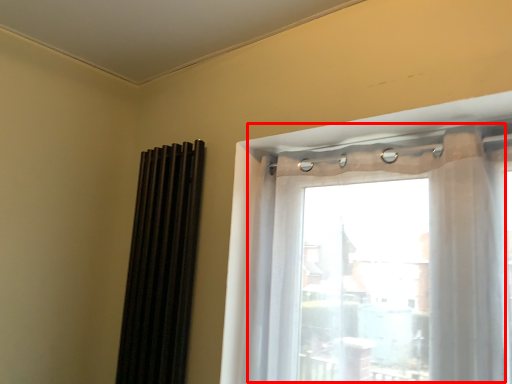
Question: From the image's perspective, what is the correct spatial relationship of window (annotated by the red box) in relation to shutter?

Choices:
 (A) below
 (B) above

Answer: (B)